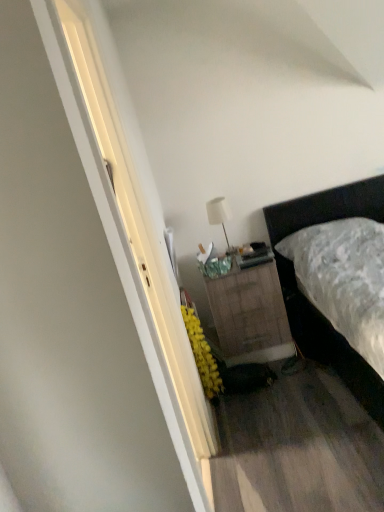
Question: Considering the positions of point (349, 201) and point (228, 210), is point (349, 201) closer or farther from the camera than point (228, 210)?

Choices:
 (A) farther
 (B) closer

Answer: (A)

Question: Is dark brown leather bed at right wider or thinner than white matte table lamp at upper center?

Choices:
 (A) thin
 (B) wide

Answer: (B)

Question: Which is farther from the dark brown leather bed at right?

Choices:
 (A) white matte table lamp at upper center
 (B) burlap-textured nightstand at center

Answer: (A)

Question: Which object is the farthest from the burlap-textured nightstand at center?

Choices:
 (A) white matte table lamp at upper center
 (B) dark brown leather bed at right

Answer: (A)